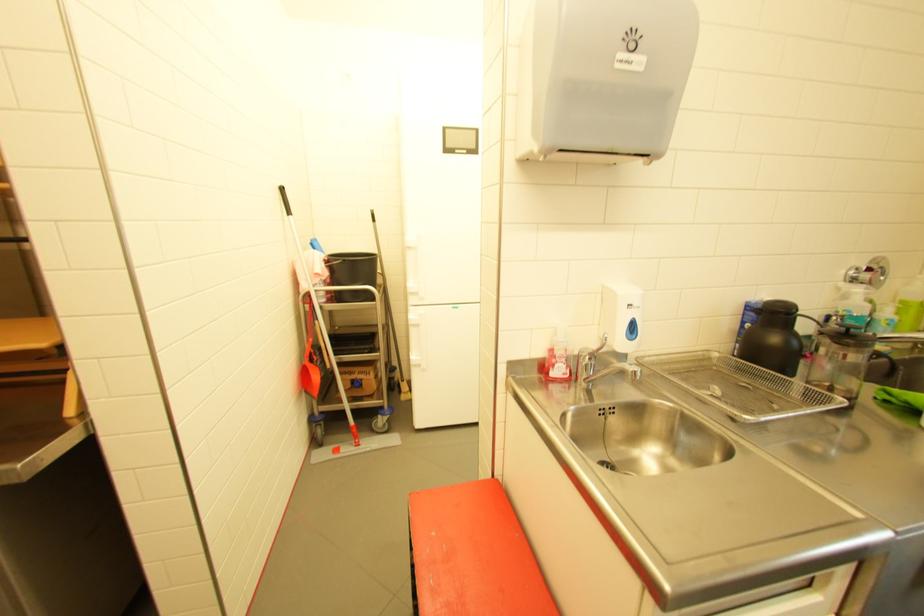
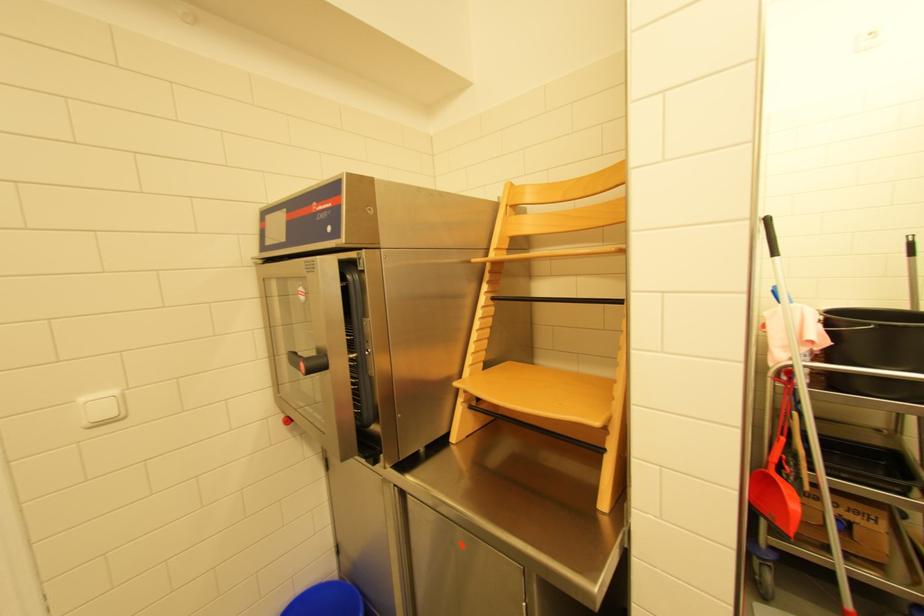
Question: The first image is from the beginning of the video and the second image is from the end. How did the camera likely rotate when shooting the video?

Choices:
 (A) Left
 (B) Right
 (C) Up
 (D) Down

Answer: (A)